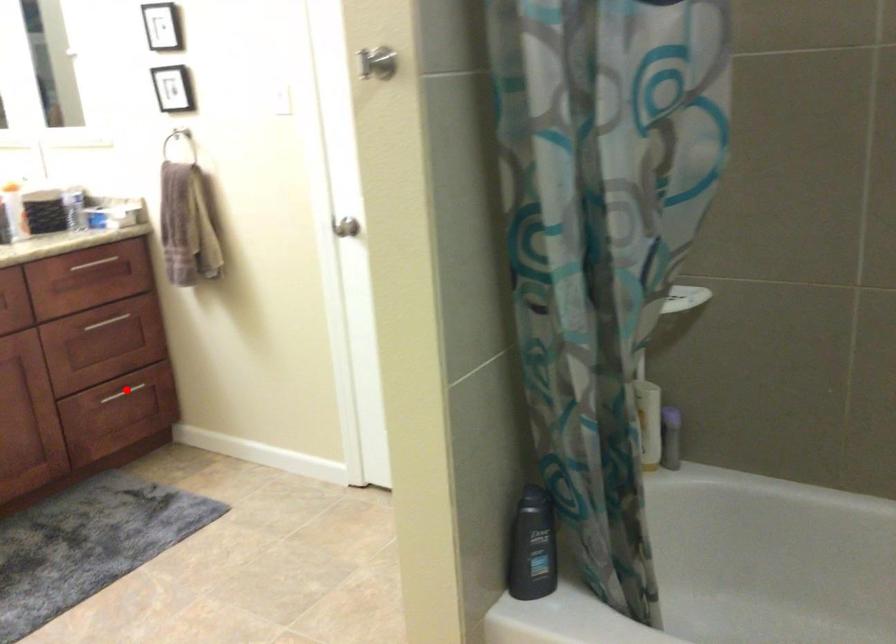
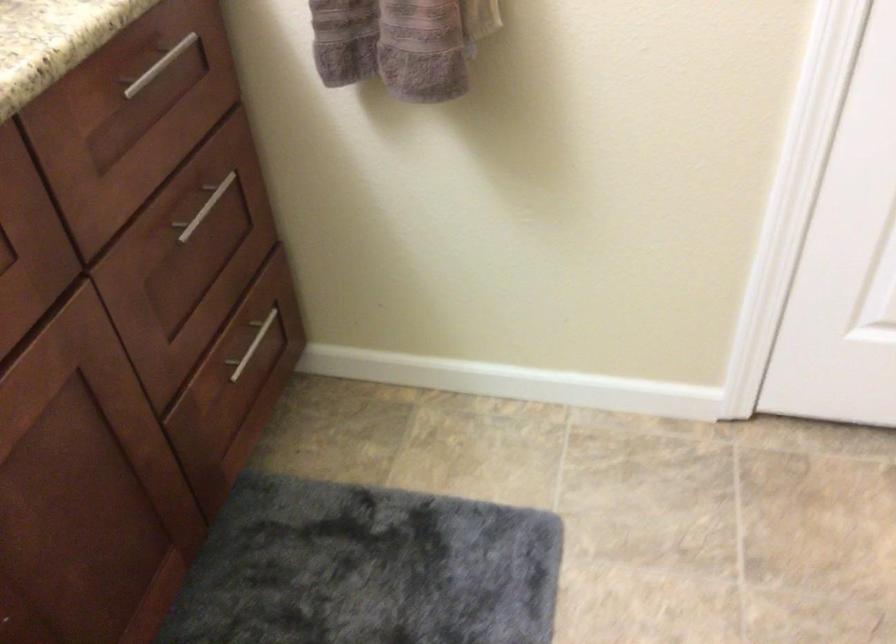
Find the pixel in the second image that matches the highlighted location in the first image.

(252, 345)